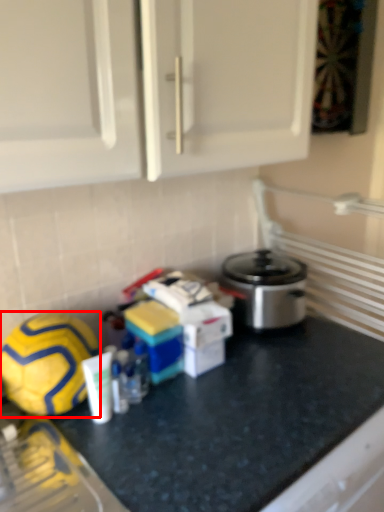
Question: From the image's perspective, what is the correct spatial positioning of football (annotated by the red box) in reference to counter?

Choices:
 (A) below
 (B) above

Answer: (B)